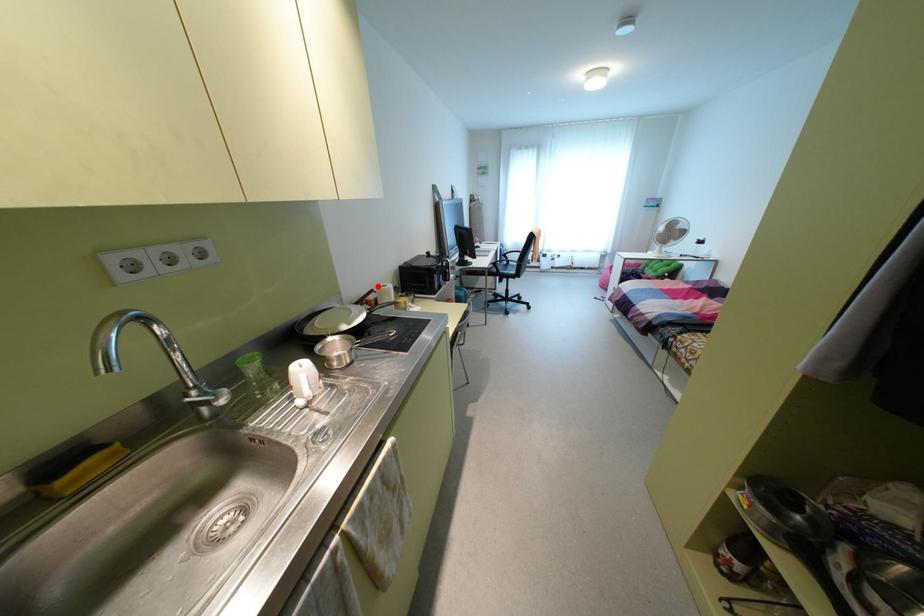
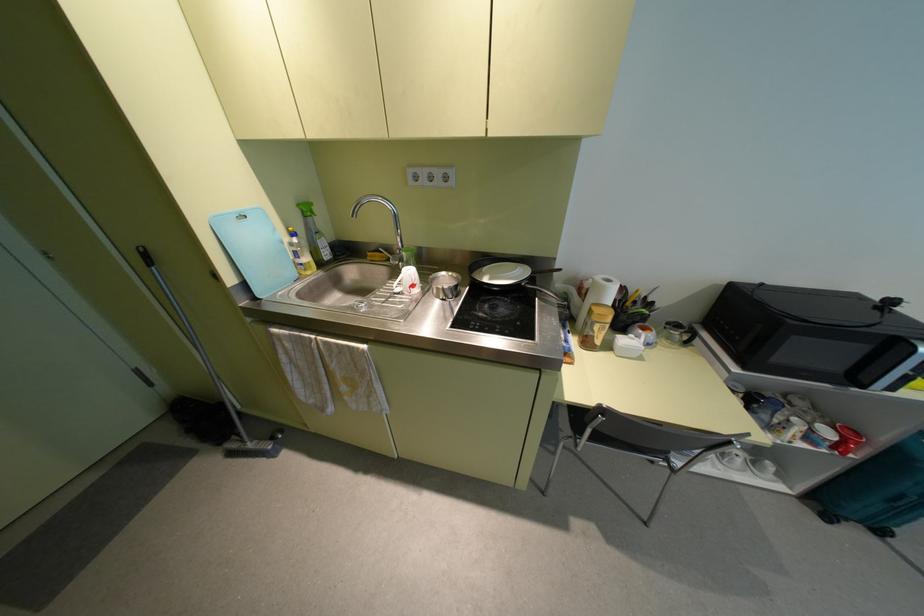
Where in the second image is the point corresponding to the highlighted location from the first image?

(599, 277)